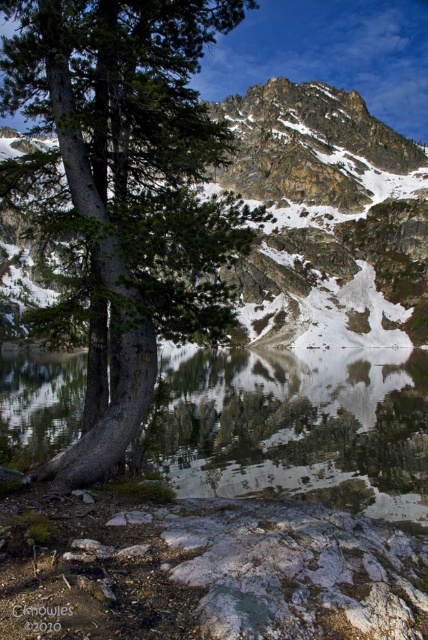
Can you confirm if green matte tree at left is wider than clear water at tree left?

In fact, green matte tree at left might be narrower than clear water at tree left.

This screenshot has height=640, width=428. Identify the location of green matte tree at left. (122, 193).

Does green matte tree at left have a larger size compared to rocky gray mountain at upper center?

Actually, green matte tree at left might be smaller than rocky gray mountain at upper center.

Does point (168, 257) come behind point (306, 163)?

No.

The width and height of the screenshot is (428, 640). Find the location of `green matte tree at left`. green matte tree at left is located at coordinates (122, 193).

Is the position of clear water at tree left less distant than that of rocky gray mountain at upper center?

Yes, it is in front of rocky gray mountain at upper center.

Between clear water at tree left and rocky gray mountain at upper center, which one is positioned higher?

rocky gray mountain at upper center

Between point (169, 392) and point (311, 195), which one is positioned behind?

Positioned behind is point (311, 195).

The width and height of the screenshot is (428, 640). Identify the location of clear water at tree left. pyautogui.click(x=297, y=426).